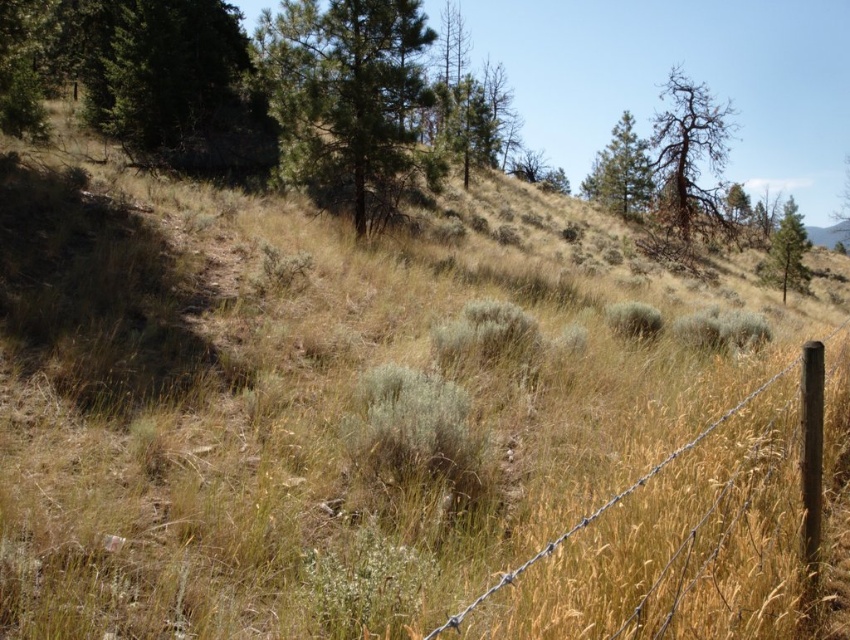
You are a hiker standing at the center of the image and want to reach the brown textured tree at upper right. Which direction should you move to get there?

The brown textured tree at upper right is located at point 0.261 on the x axis and 0.808 on the y axis. Since you are at the center, you should move towards the upper right direction to reach it.

You are a hiker standing at the lower right corner of the image. You see the brown wire fence at lower right and the green leafy tree at upper right. Which object is closer to your current position?

The brown wire fence at lower right is closer to your current position because it is positioned on the left side of the green leafy tree at upper right, meaning it is nearer to the foreground where you are standing.